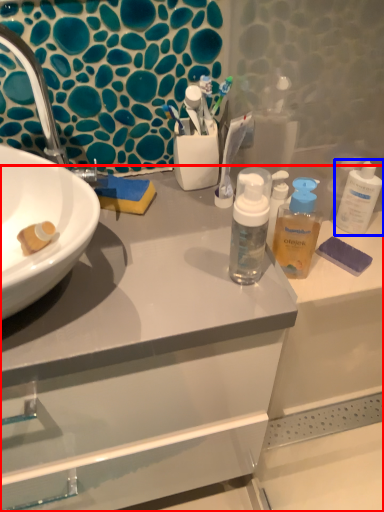
Question: Which object appears closest to the camera in this image, bathroom cabinet (highlighted by a red box) or cleaning product (highlighted by a blue box)?

Choices:
 (A) bathroom cabinet
 (B) cleaning product

Answer: (A)